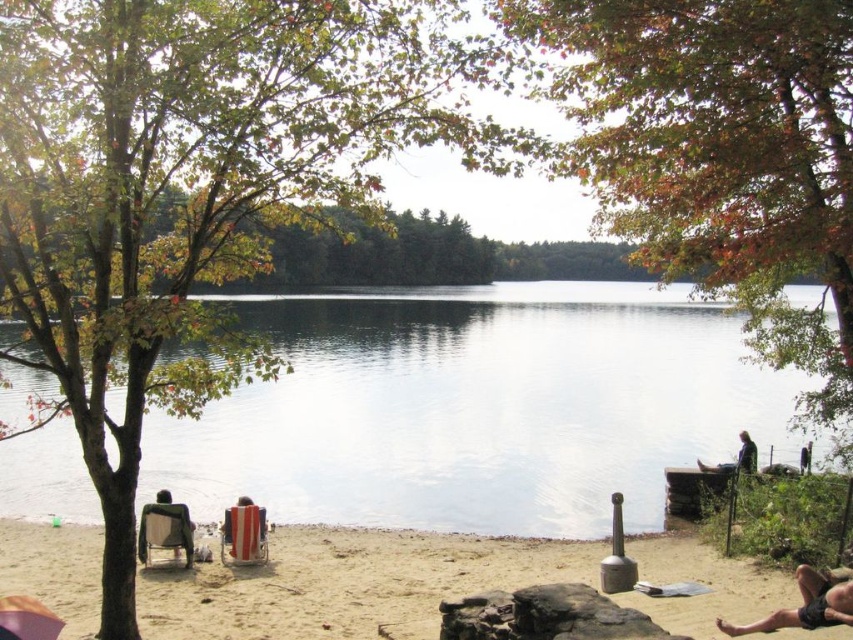
You are standing at the edge of the lake and see two points marked on the water surface. The first point is labeled as point (154, 538) and the second is point (234, 508). Which of these points is closer to you?

Point (154, 538) is in front of point (234, 508), so it is closer to you.